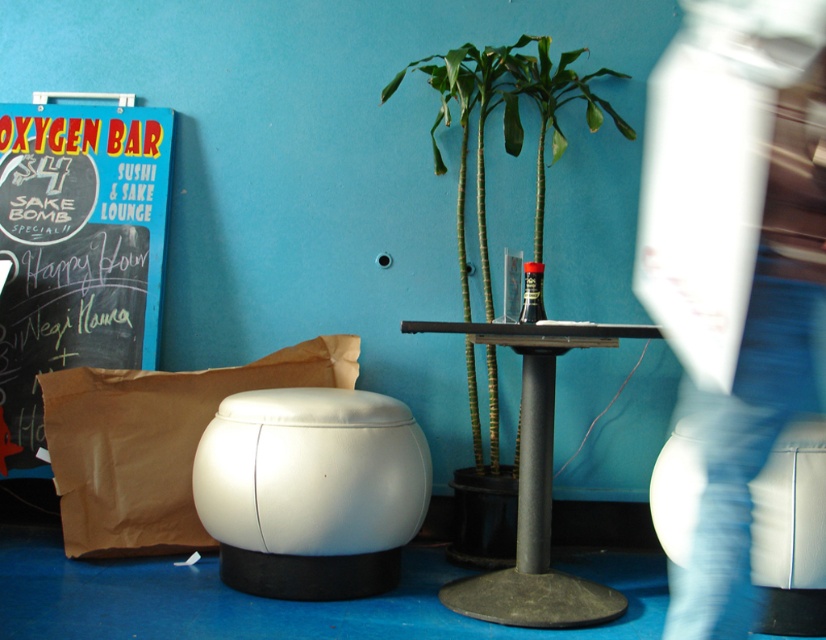
In the scene shown: You are organizing a small gathering and need to decide which item can hold more items between the brown paper bag at left and the metallic gray table at center. Based on their sizes, which one is more suitable for holding more items?

The brown paper bag at left is bigger than the metallic gray table at center, so it is more suitable for holding more items.

Based on the photo, you are a bartender who needs to place a tray of drinks on the counter. The tray requires a space wider than the black glass bottle at center. Can the white leather stool at lower center provide enough space for this?

The white leather stool at lower center has a larger width than the black glass bottle at center, so it can provide enough space for the tray of drinks.